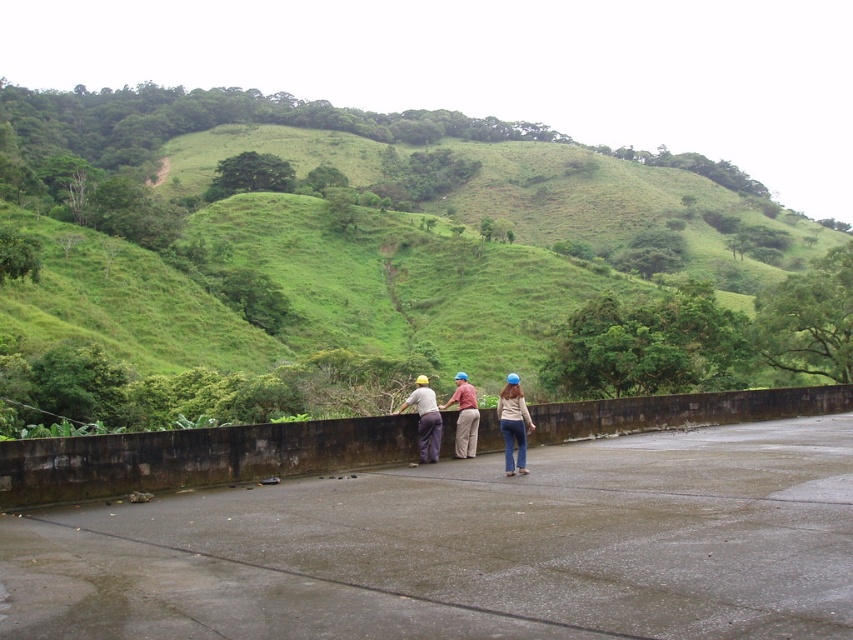
Between point (428, 428) and point (456, 387), which one is positioned behind?

Positioned behind is point (456, 387).

Is point (430, 416) more distant than point (445, 404)?

No, it is in front of (445, 404).

Describe the element at coordinates (425, 419) in the screenshot. I see `matte gray shirt at center` at that location.

Locate an element on the screen. The height and width of the screenshot is (640, 853). matte gray shirt at center is located at coordinates pyautogui.click(x=425, y=419).

Can you confirm if denim jacket at center is positioned above matte gray shirt at center?

No.

Based on the photo, is denim jacket at center to the left of matte gray shirt at center from the viewer's perspective?

No, denim jacket at center is not to the left of matte gray shirt at center.

The height and width of the screenshot is (640, 853). Describe the element at coordinates (514, 424) in the screenshot. I see `denim jacket at center` at that location.

At what (x,y) coordinates should I click in order to perform the action: click on denim jacket at center. Please return your answer as a coordinate pair (x, y). Looking at the image, I should click on (514, 424).

From the picture: Does green grassy hillside at upper center have a greater width compared to matte brown shirt at center?

Yes.

Which is more to the left, green grassy hillside at upper center or matte brown shirt at center?

From the viewer's perspective, green grassy hillside at upper center appears more on the left side.

Is point (77, 300) closer to viewer compared to point (465, 388)?

No, it is not.

Where is `green grassy hillside at upper center`? The width and height of the screenshot is (853, 640). green grassy hillside at upper center is located at coordinates (380, 259).